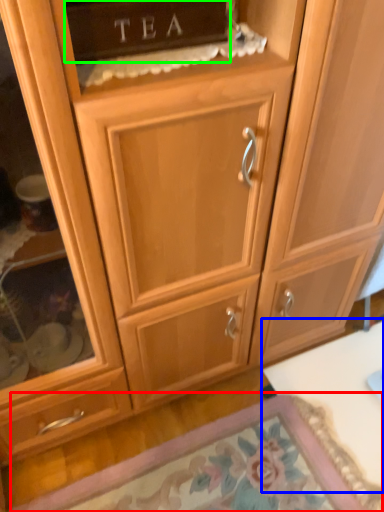
Question: Which object is the closest to the door (highlighted by a red box)? Choose among these: table (highlighted by a blue box) or cabinetry (highlighted by a green box).

Choices:
 (A) table
 (B) cabinetry

Answer: (A)